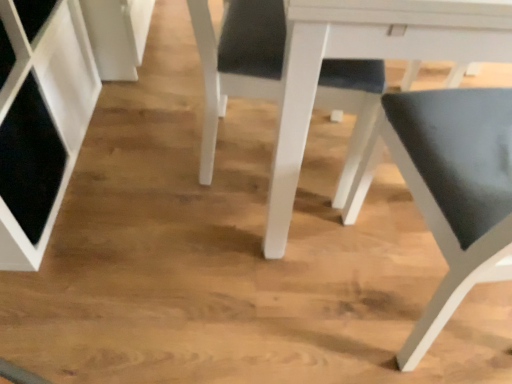
Question: Is matte black chair at center, arranged as the second chair when viewed from the right, not within white glossy table at center?

Choices:
 (A) yes
 (B) no

Answer: (B)

Question: Is matte black chair at center, arranged as the second chair when viewed from the right, positioned far away from white glossy table at center?

Choices:
 (A) yes
 (B) no

Answer: (B)

Question: From the image's perspective, is matte black chair at center, arranged as the second chair when viewed from the right, located above white glossy table at center?

Choices:
 (A) no
 (B) yes

Answer: (A)

Question: Is the position of matte black chair at center, arranged as the second chair when viewed from the right, more distant than that of white glossy table at center?

Choices:
 (A) yes
 (B) no

Answer: (A)

Question: Does matte black chair at center, arranged as the second chair when viewed from the right, have a lesser width compared to white glossy table at center?

Choices:
 (A) no
 (B) yes

Answer: (B)

Question: Considering the positions of matte black chair at lower right, which ranks as the first chair in right-to-left order, and matte black chair at center, arranged as the second chair when viewed from the right, in the image, is matte black chair at lower right, which ranks as the first chair in right-to-left order, wider or thinner than matte black chair at center, arranged as the second chair when viewed from the right,?

Choices:
 (A) wide
 (B) thin

Answer: (A)

Question: From the image's perspective, relative to matte black chair at center, arranged as the second chair when viewed from the right, is matte black chair at lower right, which ranks as the first chair in right-to-left order, above or below?

Choices:
 (A) above
 (B) below

Answer: (B)

Question: From their relative heights in the image, would you say matte black chair at lower right, which ranks as the first chair in right-to-left order, is taller or shorter than matte black chair at center, arranged as the second chair when viewed from the right?

Choices:
 (A) short
 (B) tall

Answer: (B)

Question: Is point (505, 220) closer or farther from the camera than point (290, 183)?

Choices:
 (A) farther
 (B) closer

Answer: (B)

Question: Is matte black chair at center, the first chair positioned from the left, taller or shorter than matte black chair at lower right, the second chair viewed from the left?

Choices:
 (A) short
 (B) tall

Answer: (A)

Question: From a real-world perspective, is matte black chair at center, the first chair positioned from the left, positioned above or below matte black chair at lower right, which ranks as the first chair in right-to-left order?

Choices:
 (A) above
 (B) below

Answer: (B)

Question: In the image, is matte black chair at center, arranged as the second chair when viewed from the right, on the left side or the right side of matte black chair at lower right, the second chair viewed from the left?

Choices:
 (A) right
 (B) left

Answer: (B)

Question: From the image's perspective, is matte black chair at center, the first chair positioned from the left, located above or below matte black chair at lower right, which ranks as the first chair in right-to-left order?

Choices:
 (A) above
 (B) below

Answer: (A)

Question: Relative to white glossy table at center, is matte black chair at center, arranged as the second chair when viewed from the right, in front or behind?

Choices:
 (A) front
 (B) behind

Answer: (B)

Question: Is matte black chair at center, the first chair positioned from the left, to the left or to the right of white glossy table at center in the image?

Choices:
 (A) left
 (B) right

Answer: (A)